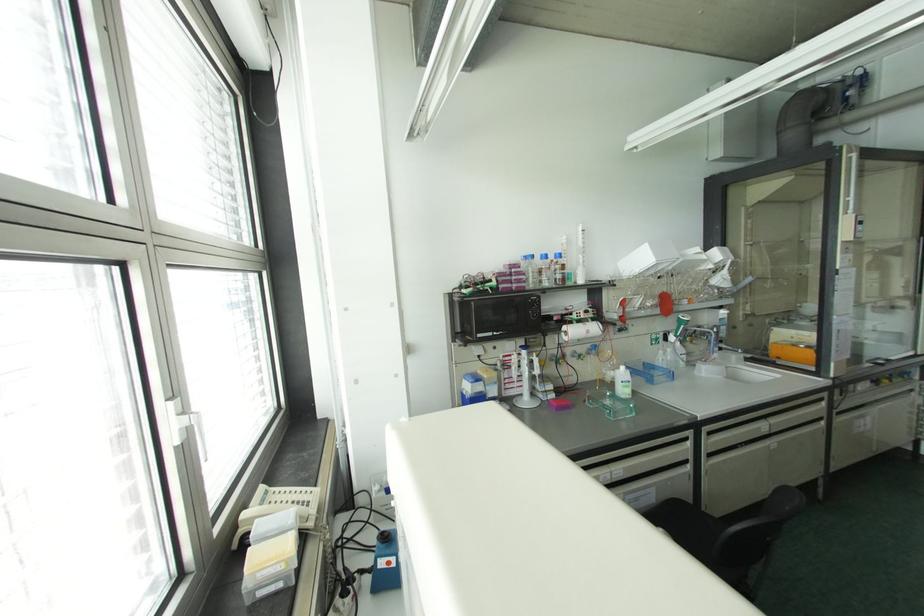
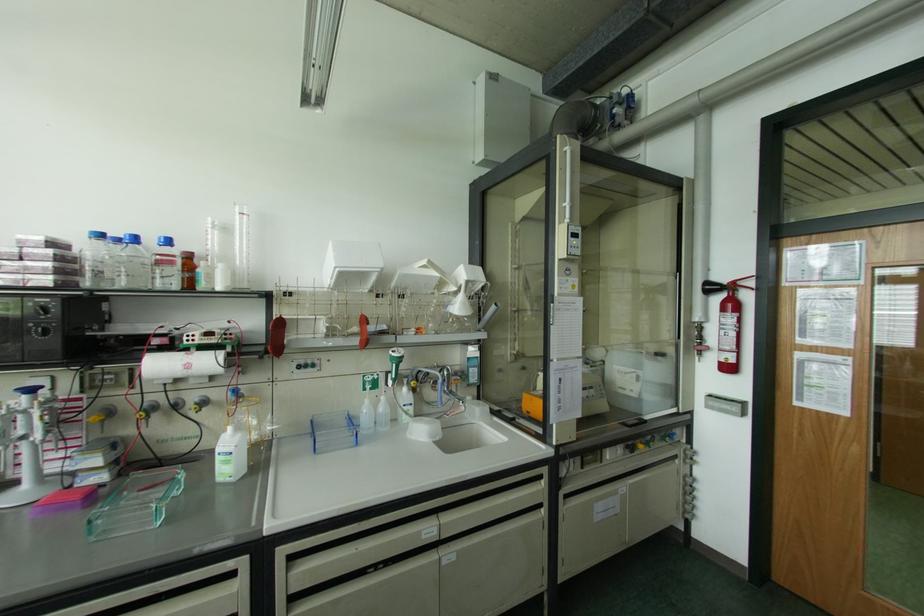
In the second image, find the point that corresponds to pixel 558 254 in the first image.

(167, 241)